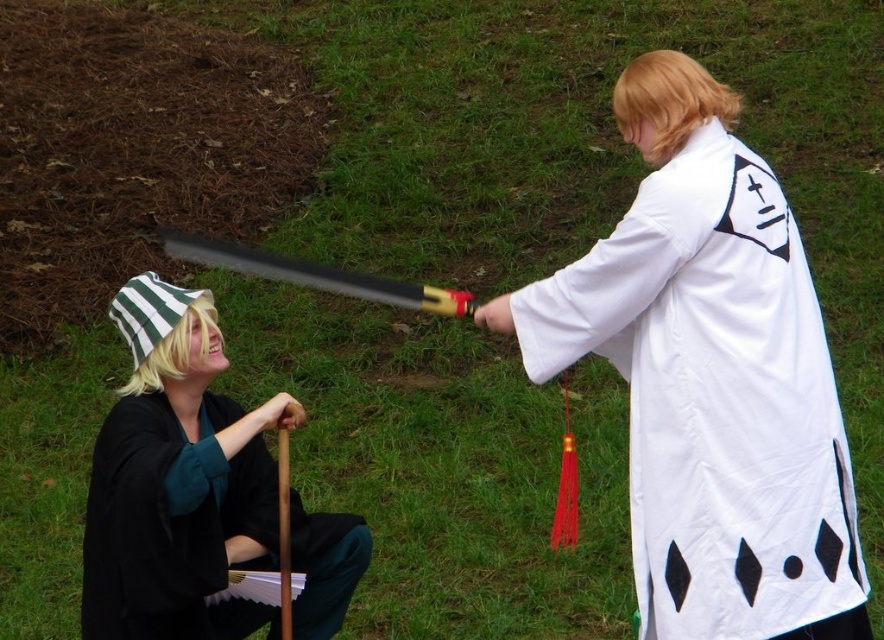
Can you confirm if white fabric kimono at upper right is bigger than black matte kimono at lower left?

Yes.

Is white fabric kimono at upper right closer to the viewer compared to black matte kimono at lower left?

No, it is behind black matte kimono at lower left.

You are a GUI agent. You are given a task and a screenshot of the screen. Output one action in this format:
    pyautogui.click(x=<x>, y=<y>)
    Task: Click on the white fabric kimono at upper right
    
    Given the screenshot: What is the action you would take?
    pyautogui.click(x=714, y=397)

The image size is (884, 640). I want to click on white fabric kimono at upper right, so click(714, 397).